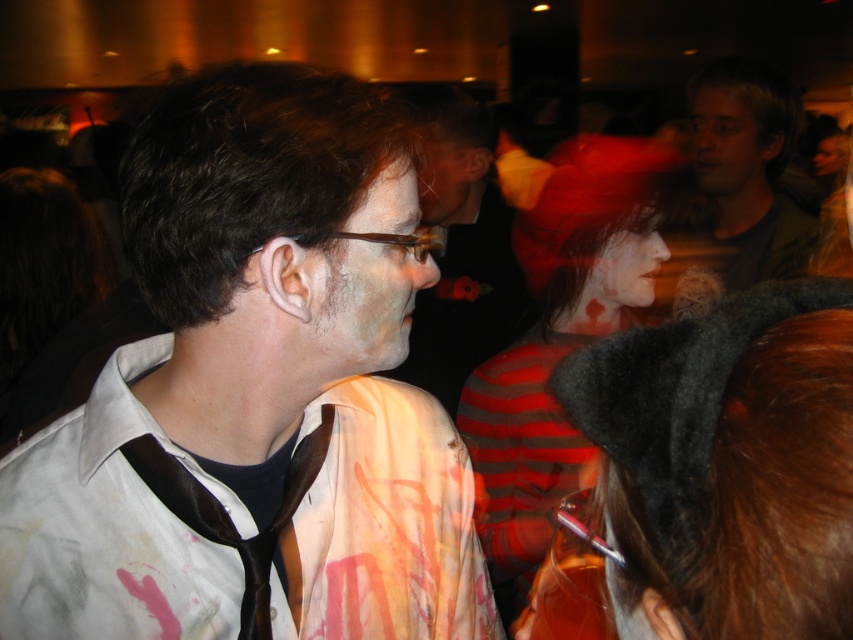
You are at a social event and want to place the transparent plastic glasses at center on top of the striped wool sweater at center. Is this possible based on their sizes?

The striped wool sweater at center is taller than transparent plastic glasses at center, so placing the transparent plastic glasses at center on top of the striped wool sweater at center is possible since the sweater is taller and can support the glasses.

Based on the scene description, what object is located at the coordinates point (560, 339)?

The striped wool sweater at center is located at point (560, 339).

You are at a party and want to take a photo of both the dark gray felt cat ears at lower right and the striped wool sweater at center. Which object should you focus on first to ensure both are in clear focus?

You should focus on the dark gray felt cat ears at lower right first since it is closer to the viewer than the striped wool sweater at center. By focusing on the closer object, the sweater at center will still be in focus due to the depth of field, ensuring both are clear.